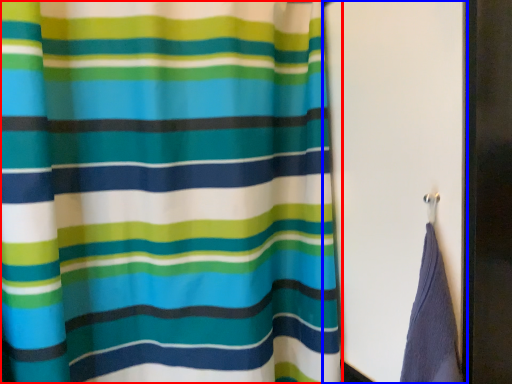
Question: Which object appears farthest to the camera in this image, curtain (highlighted by a red box) or screen door (highlighted by a blue box)?

Choices:
 (A) curtain
 (B) screen door

Answer: (B)